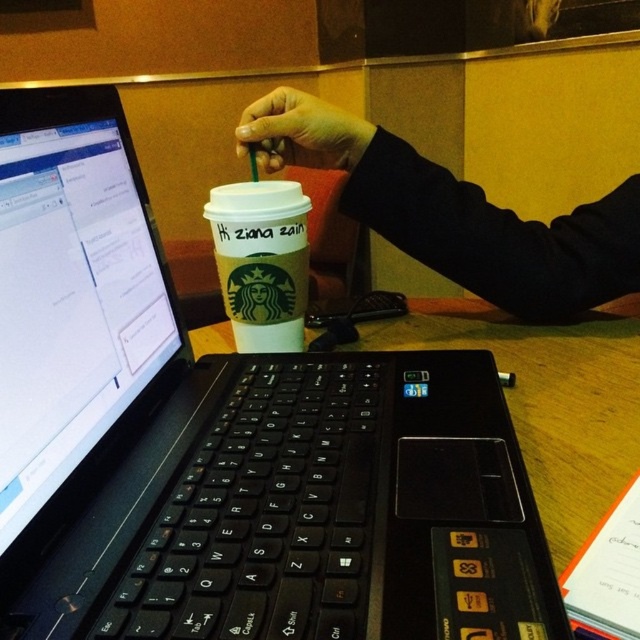
Can you confirm if white paper cup at center is positioned below smooth skin hand at upper center?

Indeed, white paper cup at center is positioned under smooth skin hand at upper center.

You are a GUI agent. You are given a task and a screenshot of the screen. Output one action in this format:
    pyautogui.click(x=<x>, y=<y>)
    Task: Click on the white paper cup at center
    The width and height of the screenshot is (640, 640).
    Given the screenshot: What is the action you would take?
    pyautogui.click(x=260, y=260)

Who is more forward, (273,180) or (244,145)?

Point (244,145) is in front.

Find the location of a particular element. white paper cup at center is located at coordinates (260, 260).

You are a GUI agent. You are given a task and a screenshot of the screen. Output one action in this format:
    pyautogui.click(x=<x>, y=<y>)
    Task: Click on the matte plastic cup at center
    Image resolution: width=640 pixels, height=640 pixels.
    Given the screenshot: What is the action you would take?
    pyautogui.click(x=454, y=212)

Does matte plastic cup at center appear on the left side of smooth skin hand at upper center?

No, matte plastic cup at center is not to the left of smooth skin hand at upper center.

Is point (291, 156) in front of point (356, 120)?

No.

Locate an element on the screen. Image resolution: width=640 pixels, height=640 pixels. matte plastic cup at center is located at coordinates (454, 212).

Locate an element on the screen. This screenshot has height=640, width=640. matte plastic cup at center is located at coordinates (454, 212).

Can you confirm if matte plastic cup at center is positioned below white paper cup at center?

Incorrect, matte plastic cup at center is not positioned below white paper cup at center.

The height and width of the screenshot is (640, 640). What are the coordinates of `matte plastic cup at center` in the screenshot? It's located at (454, 212).

This screenshot has height=640, width=640. In order to click on matte plastic cup at center in this screenshot , I will do `click(454, 212)`.